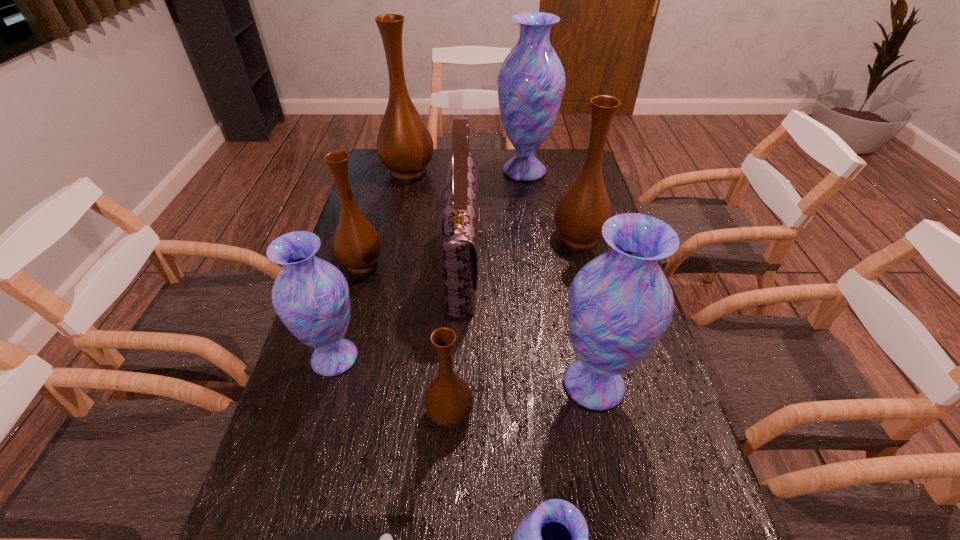
At what (x,y) coordinates should I click in order to perform the action: click on the biggest purple vase. Please return your answer as a coordinate pair (x, y). The width and height of the screenshot is (960, 540). Looking at the image, I should click on (531, 81).

I want to click on the farthest brown vase, so point(405,146).

The width and height of the screenshot is (960, 540). I want to click on handbag, so click(459, 251).

The height and width of the screenshot is (540, 960). Identify the location of the rightmost brown vase. (580, 214).

Where is `the third smallest purple vase`? The image size is (960, 540). the third smallest purple vase is located at coordinates (620, 304).

This screenshot has height=540, width=960. I want to click on the third biggest brown vase, so click(357, 245).

This screenshot has height=540, width=960. In order to click on the second smallest purple vase in this screenshot , I will do `click(310, 295)`.

Locate an element on the screen. The width and height of the screenshot is (960, 540). the smallest brown vase is located at coordinates (448, 401).

The width and height of the screenshot is (960, 540). I want to click on the fifth vase from right to left, so click(448, 401).

I want to click on blank area located on the right of the biggest purple vase, so click(592, 171).